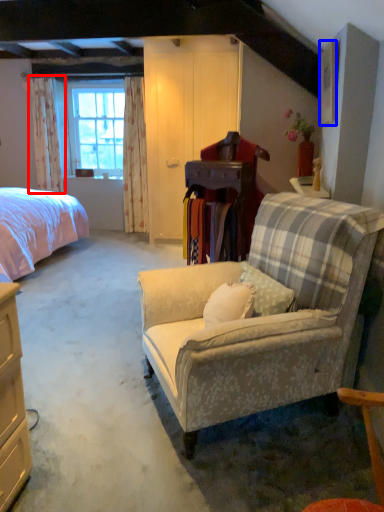
Question: Which of the following is the farthest to the observer, curtain (highlighted by a red box) or picture frame (highlighted by a blue box)?

Choices:
 (A) curtain
 (B) picture frame

Answer: (A)